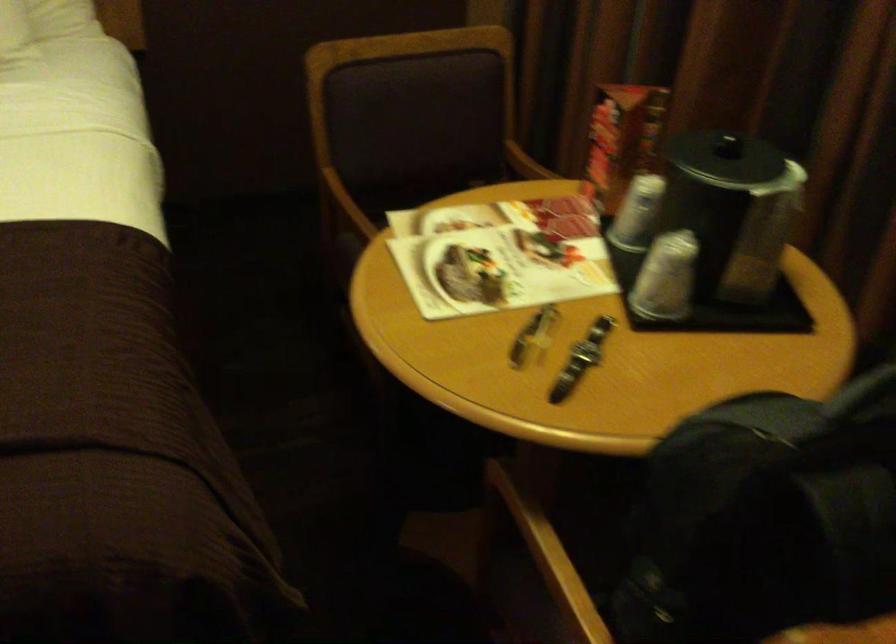
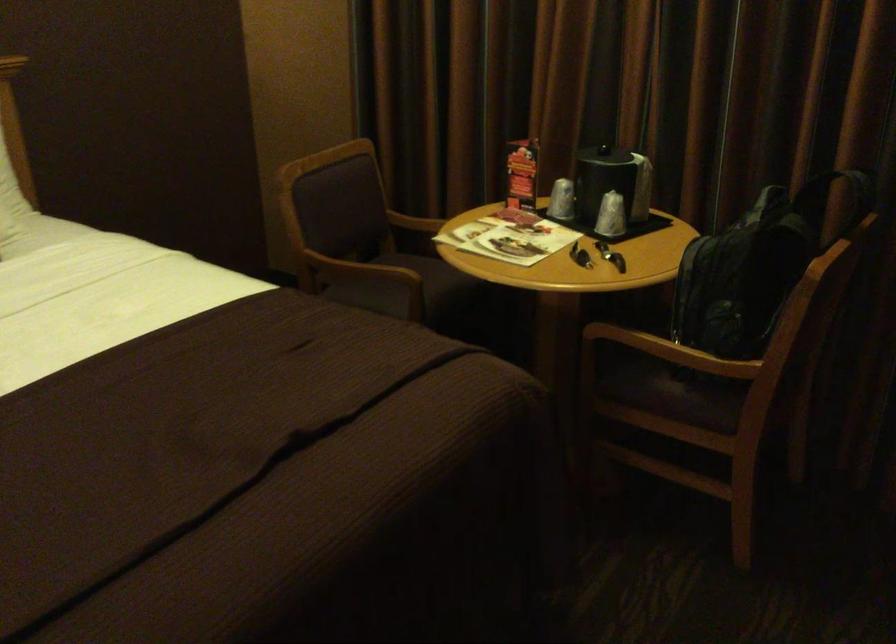
In the second image, find the point that corresponds to [550,327] in the first image.

(580, 254)